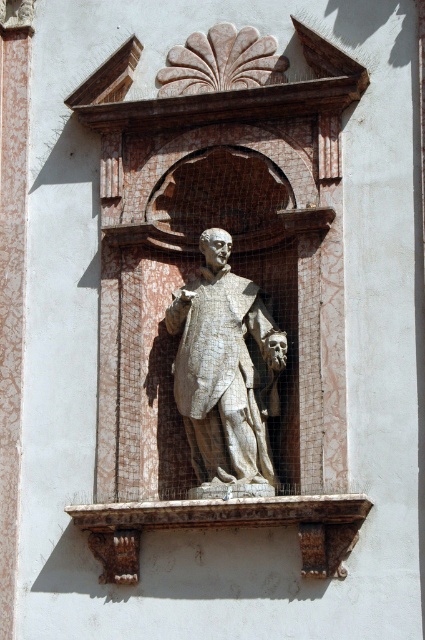
You are an art conservator tasked with cleaning the white marble statue at center and the rustic stone ledge at center. You have a limited amount of cleaning solution that can cover an area of 2 square meters. Which object requires more cleaning solution based on their relative positions?

The white marble statue at center is further to the viewer than rustic stone ledge at center, so it is closer to you. Since the cleaning solution coverage depends on proximity, the statue would require more solution to reach effectively.

You are an interior designer assessing the space where the white marble statue at center and the rustic stone ledge at center are placed. Based on their sizes, which object would you recommend placing a small decorative item on top of to ensure stability?

The rustic stone ledge at center is taller than the white marble statue at center, so placing the decorative item on the rustic stone ledge at center would provide a more stable base due to its height and surface area.